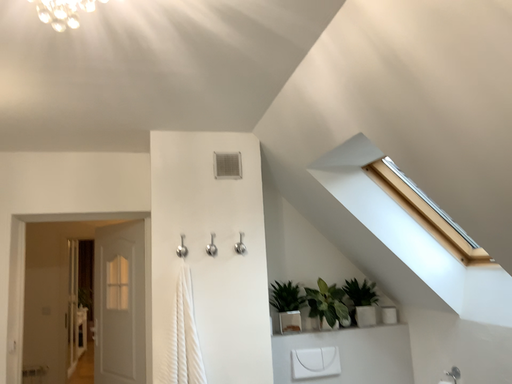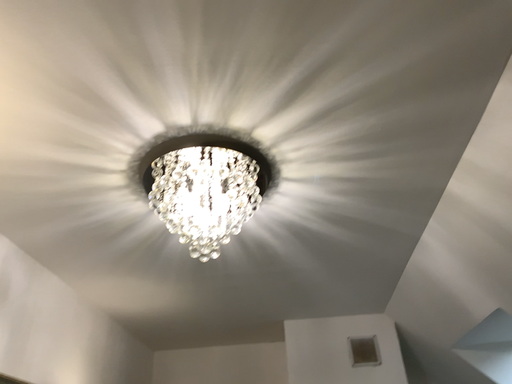
Question: Which way did the camera rotate in the video?

Choices:
 (A) rotated downward
 (B) rotated upward

Answer: (B)